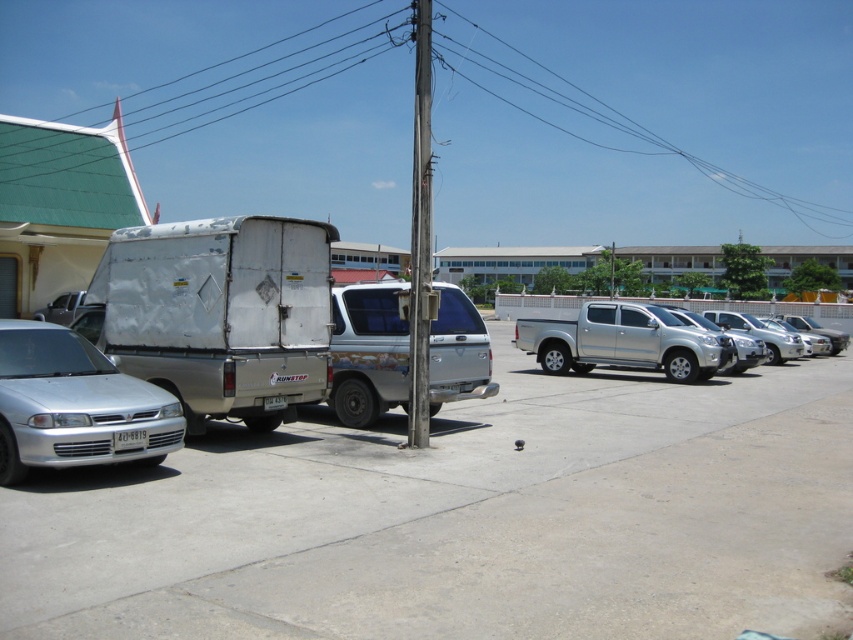
Question: Estimate the real-world distances between objects in this image. Which object is closer to the silver metallic van at center?

Choices:
 (A) silver metallic sedan at left
 (B) gray concrete pavement at center
 (C) silver metallic sedan at right
 (D) satin silver sedan at center-right

Answer: (B)

Question: Can you confirm if gray concrete pavement at center is positioned to the left of satin silver sedan at center-right?

Choices:
 (A) no
 (B) yes

Answer: (B)

Question: Estimate the real-world distances between objects in this image. Which object is closer to the silver metallic sedan at left?

Choices:
 (A) weathered wood pole at center
 (B) silver metallic truck at center-right

Answer: (A)

Question: Does silver metallic sedan at left appear over satin silver sedan at center-right?

Choices:
 (A) yes
 (B) no

Answer: (B)

Question: Can you confirm if silver metallic sedan at right is thinner than satin silver sedan at center-right?

Choices:
 (A) no
 (B) yes

Answer: (B)

Question: Which object is closer to the camera taking this photo?

Choices:
 (A) metallic wire at upper center
 (B) silver metallic van at center

Answer: (A)